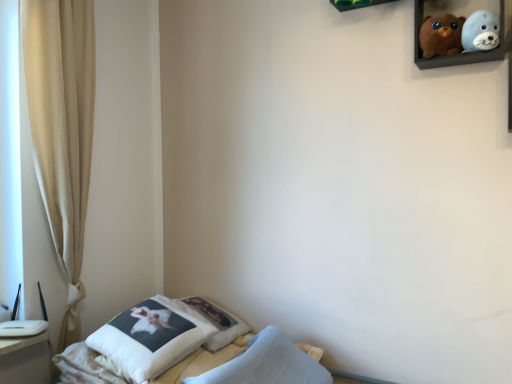
Question: Can you confirm if brown plush bear at upper right, marked as the second toy in a right-to-left arrangement, is shorter than white soft pillow at lower left, the first pillow from the front?

Choices:
 (A) yes
 (B) no

Answer: (A)

Question: Does brown plush bear at upper right, marked as the second toy in a right-to-left arrangement, have a greater height compared to white soft pillow at lower left, the first pillow from the front?

Choices:
 (A) no
 (B) yes

Answer: (A)

Question: From a real-world perspective, is brown plush bear at upper right, the 1th toy in the left-to-right sequence, located higher than white soft pillow at lower left, the 2th pillow from the back?

Choices:
 (A) yes
 (B) no

Answer: (A)

Question: From a real-world perspective, is brown plush bear at upper right, the 1th toy in the left-to-right sequence, under white soft pillow at lower left, the first pillow from the front?

Choices:
 (A) no
 (B) yes

Answer: (A)

Question: From the image's perspective, is brown plush bear at upper right, marked as the second toy in a right-to-left arrangement, on white soft pillow at lower left, the first pillow from the front?

Choices:
 (A) no
 (B) yes

Answer: (B)

Question: Looking at their shapes, would you say beige fabric curtain at left is wider or thinner than white soft pillow at lower left, the 2th pillow from the back?

Choices:
 (A) wide
 (B) thin

Answer: (B)

Question: From the image's perspective, relative to white soft pillow at lower left, the 2th pillow from the back, is beige fabric curtain at left above or below?

Choices:
 (A) above
 (B) below

Answer: (A)

Question: From their relative heights in the image, would you say beige fabric curtain at left is taller or shorter than white soft pillow at lower left, the first pillow from the front?

Choices:
 (A) short
 (B) tall

Answer: (B)

Question: Would you say beige fabric curtain at left is to the left or to the right of white soft pillow at lower left, the 2th pillow from the back, in the picture?

Choices:
 (A) left
 (B) right

Answer: (A)

Question: Considering the positions of point (78, 327) and point (487, 13), is point (78, 327) closer or farther from the camera than point (487, 13)?

Choices:
 (A) farther
 (B) closer

Answer: (A)

Question: Considering the positions of beige fabric curtain at left and soft plush seal at upper right, which is the 1th toy from right to left, in the image, is beige fabric curtain at left taller or shorter than soft plush seal at upper right, which is the 1th toy from right to left,?

Choices:
 (A) tall
 (B) short

Answer: (A)

Question: Visually, is beige fabric curtain at left positioned to the left or to the right of soft plush seal at upper right, which is counted as the second toy, starting from the left?

Choices:
 (A) right
 (B) left

Answer: (B)

Question: Considering the positions of beige fabric curtain at left and soft plush seal at upper right, which is the 1th toy from right to left, in the image, is beige fabric curtain at left wider or thinner than soft plush seal at upper right, which is the 1th toy from right to left,?

Choices:
 (A) wide
 (B) thin

Answer: (A)

Question: From a real-world perspective, relative to wooden shelf at upper center, is white soft pillow at lower left vertically above or below?

Choices:
 (A) below
 (B) above

Answer: (A)

Question: Is white soft pillow at lower left inside the boundaries of wooden shelf at upper center, or outside?

Choices:
 (A) outside
 (B) inside

Answer: (A)